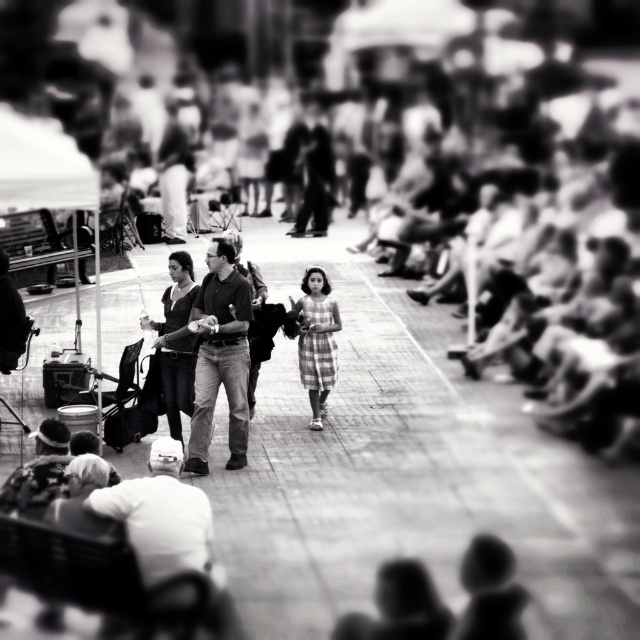
Question: Can you confirm if plaid fabric dress at center is wider than camouflage hat at lower left?

Choices:
 (A) yes
 (B) no

Answer: (A)

Question: Observing the image, what is the correct spatial positioning of smooth gray shirt at lower left in reference to plaid fabric dress at center?

Choices:
 (A) right
 (B) left

Answer: (B)

Question: Is dark gray jeans at center in front of camouflage hat at lower left?

Choices:
 (A) yes
 (B) no

Answer: (B)

Question: Among these points, which one is nearest to the camera?

Choices:
 (A) (38, 449)
 (B) (173, 538)
 (C) (321, 307)
 (D) (244, 403)

Answer: (B)

Question: Which point is closer to the camera taking this photo?

Choices:
 (A) (307, 348)
 (B) (156, 490)
 (C) (36, 460)
 (D) (220, 292)

Answer: (B)

Question: Which is nearer to the camouflage hat at lower left?

Choices:
 (A) plaid fabric dress at center
 (B) smooth gray shirt at lower left
 (C) dark gray jeans at center

Answer: (B)